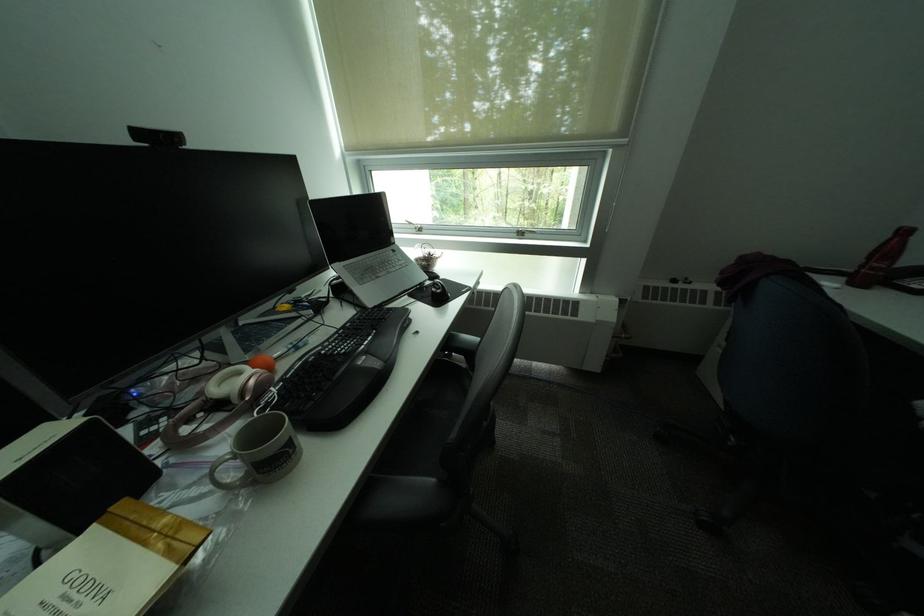
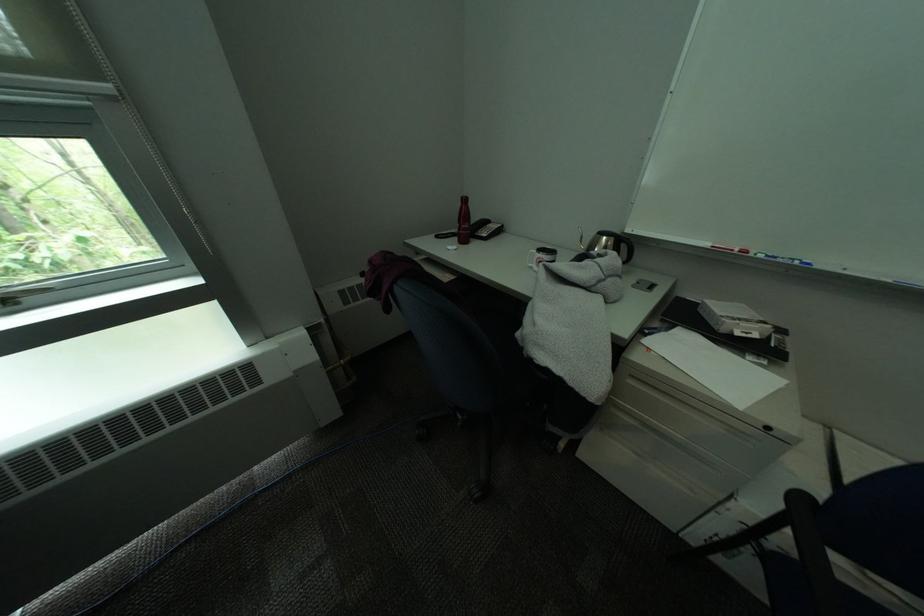
Question: The camera is either moving clockwise (left) or counter-clockwise (right) around the object. The first image is from the beginning of the video and the second image is from the end. Is the camera moving left or right when shooting the video?

Choices:
 (A) Left
 (B) Right

Answer: (A)